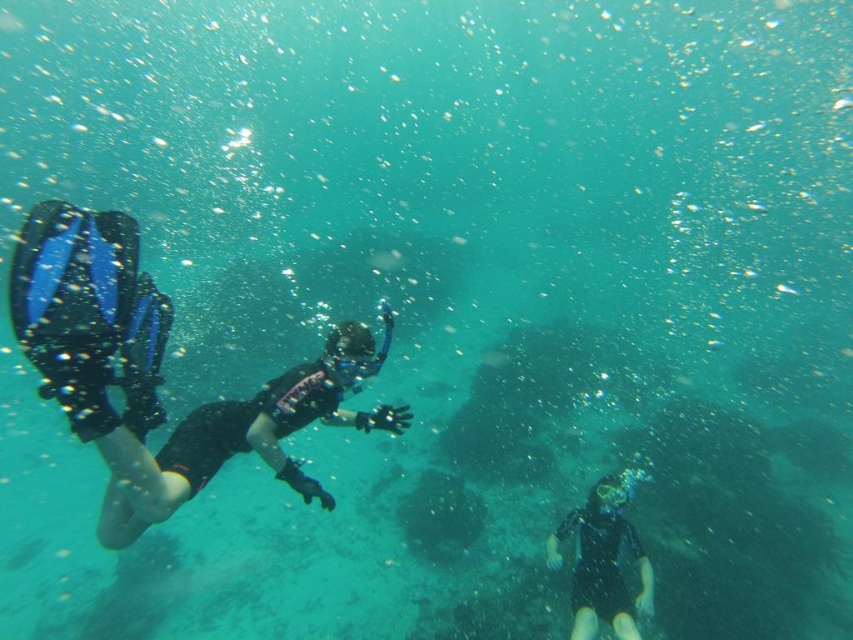
Which is below, black matte wetsuit at left or black matte wetsuit at lower right?

black matte wetsuit at lower right is below.

Does black matte wetsuit at left appear on the left side of black matte wetsuit at lower right?

Yes, black matte wetsuit at left is to the left of black matte wetsuit at lower right.

The image size is (853, 640). Describe the element at coordinates (242, 435) in the screenshot. I see `black matte wetsuit at left` at that location.

At what (x,y) coordinates should I click in order to perform the action: click on black matte wetsuit at left. Please return your answer as a coordinate pair (x, y). Looking at the image, I should click on (242, 435).